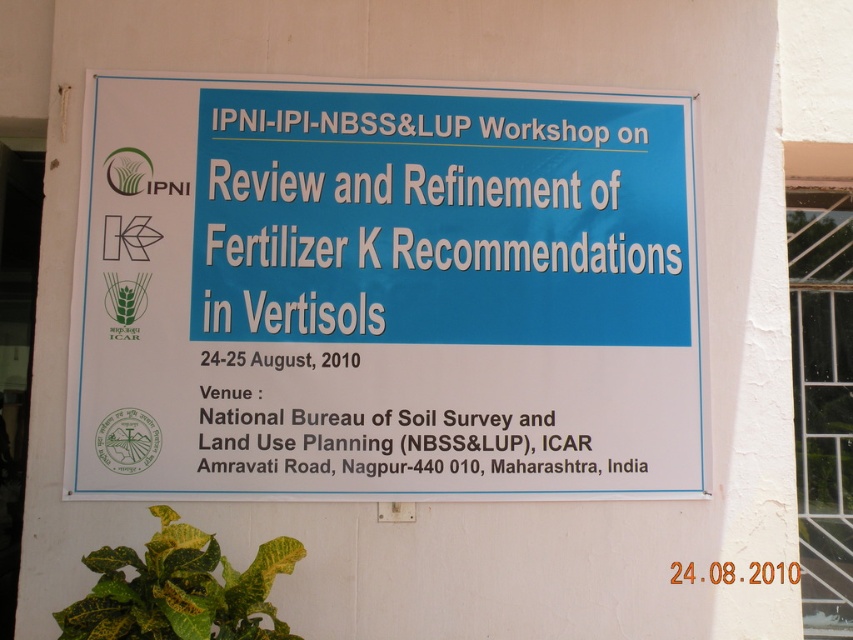
Is white paper sign at center thinner than yellow-green leafy plant at lower left?

Incorrect, white paper sign at center's width is not less than yellow-green leafy plant at lower left's.

Is white paper sign at center positioned behind yellow-green leafy plant at lower left?

Yes, white paper sign at center is further from the viewer.

Is point (477, 173) less distant than point (267, 611)?

No, it is not.

At what (x,y) coordinates should I click in order to perform the action: click on white paper sign at center. Please return your answer as a coordinate pair (x, y). Looking at the image, I should click on (384, 292).